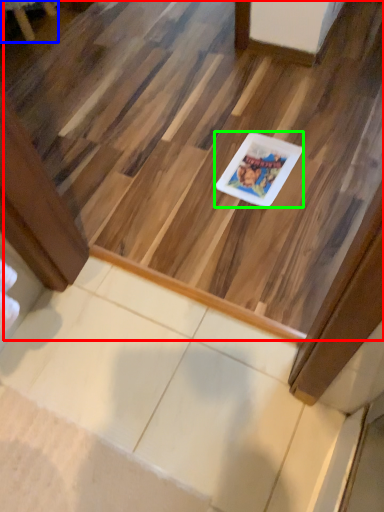
Question: Which is farther away from stairwell (highlighted by a red box)? furniture (highlighted by a blue box) or glass plate (highlighted by a green box)?

Choices:
 (A) furniture
 (B) glass plate

Answer: (A)